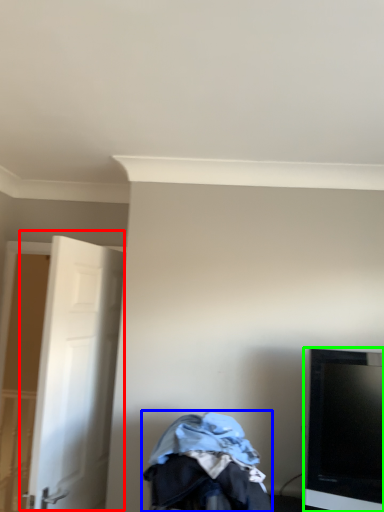
Question: Which object is the closest to the door (highlighted by a red box)? Choose among these: baby carriage (highlighted by a blue box) or television (highlighted by a green box).

Choices:
 (A) baby carriage
 (B) television

Answer: (A)